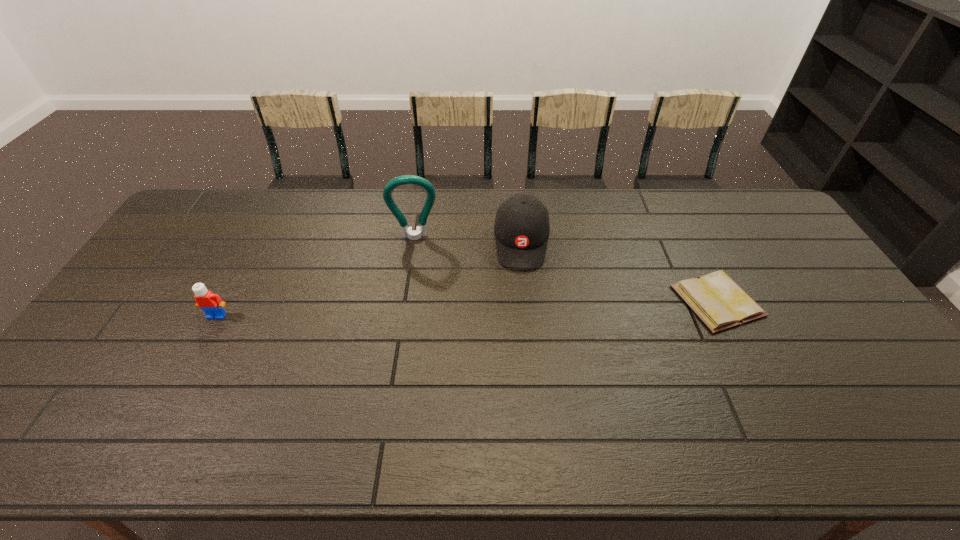
At what (x,y) coordinates should I click in order to perform the action: click on object that is the closest one to the tallest object. Please return your answer as a coordinate pair (x, y). Looking at the image, I should click on (522, 227).

Where is `object that stands as the second closest to the bottle opener`? The width and height of the screenshot is (960, 540). object that stands as the second closest to the bottle opener is located at coordinates (211, 304).